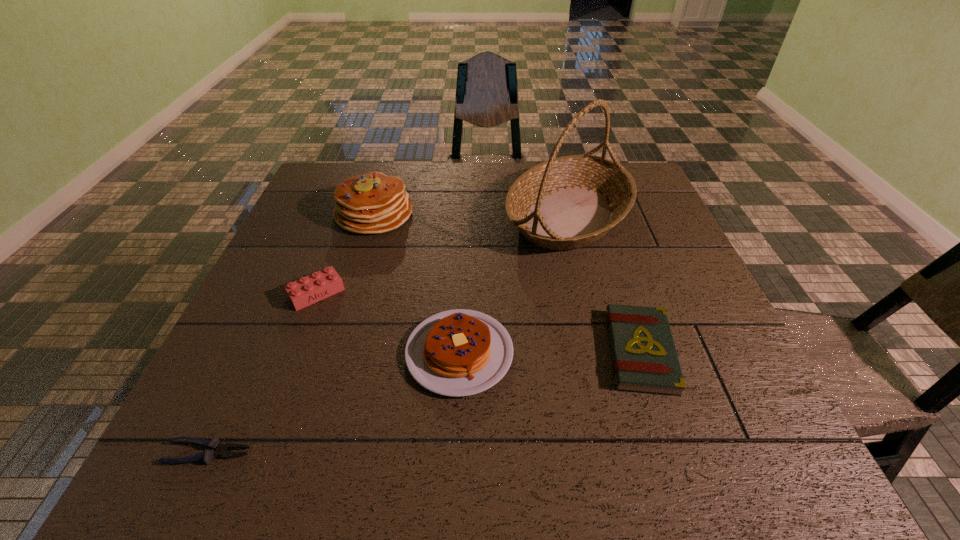
Locate an element on the screen. vacant space in between the pliers and the taller pancake is located at coordinates (292, 333).

Image resolution: width=960 pixels, height=540 pixels. Identify the location of free spot between the tallest object and the pliers. (389, 334).

Find the location of a particular element. This screenshot has width=960, height=540. the fourth closest object to the second tallest object is located at coordinates (644, 357).

Locate an element on the screen. The image size is (960, 540). object that stands as the fourth closest to the basket is located at coordinates (308, 290).

This screenshot has height=540, width=960. Identify the location of vacant space that satisfies the following two spatial constraints: 1. on the front side of the Lego; 2. at the gripping part of the shortest object. (255, 453).

Image resolution: width=960 pixels, height=540 pixels. Find the location of `vacant region that satisfies the following two spatial constraints: 1. on the front side of the left pancake; 2. on the left side of the fifth tallest object`. vacant region that satisfies the following two spatial constraints: 1. on the front side of the left pancake; 2. on the left side of the fifth tallest object is located at coordinates (332, 352).

I want to click on free space that satisfies the following two spatial constraints: 1. on the front side of the Lego; 2. on the right side of the fifth tallest object, so click(x=295, y=352).

Where is `vacant position in the image that satisfies the following two spatial constraints: 1. on the front side of the book; 2. at the gripping part of the shortest object`? The image size is (960, 540). vacant position in the image that satisfies the following two spatial constraints: 1. on the front side of the book; 2. at the gripping part of the shortest object is located at coordinates (673, 453).

Locate an element on the screen. The height and width of the screenshot is (540, 960). free region that satisfies the following two spatial constraints: 1. on the back side of the tallest object; 2. on the left side of the fourth nearest object is located at coordinates (347, 215).